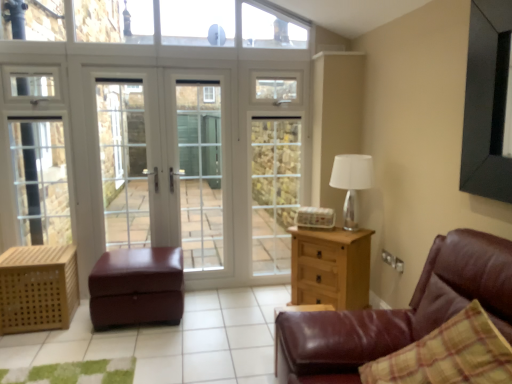
Identify the location of brown leather couch at right. This screenshot has width=512, height=384. (401, 312).

The image size is (512, 384). What do you see at coordinates (401, 312) in the screenshot? I see `brown leather couch at right` at bounding box center [401, 312].

Identify the location of white glass screen door at center, acting as the second screen door starting from the left. (200, 172).

The height and width of the screenshot is (384, 512). In order to click on white glass screen door at center, which ranks as the first screen door in right-to-left order in this screenshot , I will do `click(274, 190)`.

What do you see at coordinates (274, 190) in the screenshot?
I see `white glass screen door at center, which ranks as the first screen door in right-to-left order` at bounding box center [274, 190].

You are a GUI agent. You are given a task and a screenshot of the screen. Output one action in this format:
    pyautogui.click(x=<x>, y=<y>)
    Task: Click on the white glass screen door at left, the third screen door when ordered from right to left
    
    Given the screenshot: What is the action you would take?
    pyautogui.click(x=123, y=162)

From the image's perspective, is clear glass window at upper center above white glass door at center?

Correct, clear glass window at upper center appears higher than white glass door at center in the image.

Would you say clear glass window at upper center is inside or outside white glass door at center?

clear glass window at upper center is outside white glass door at center.

Are clear glass window at upper center and white glass door at center making contact?

No, clear glass window at upper center is not next to white glass door at center.

From the image's perspective, is clear glass window at upper center positioned above or below light wood/texture chest of drawers at right?

From the image's perspective, clear glass window at upper center appears above light wood/texture chest of drawers at right.

Can you confirm if clear glass window at upper center is positioned to the right of light wood/texture chest of drawers at right?

No.

Is clear glass window at upper center further to camera compared to light wood/texture chest of drawers at right?

Yes, clear glass window at upper center is further from the camera.

Is clear glass window at upper center oriented towards light wood/texture chest of drawers at right?

No, clear glass window at upper center is not oriented towards light wood/texture chest of drawers at right.

Are light wood/texture chest of drawers at right and silver metallic table lamp at upper right located far from each other?

They are positioned close to each other.

Considering the positions of objects light wood/texture chest of drawers at right and silver metallic table lamp at upper right in the image provided, who is in front, light wood/texture chest of drawers at right or silver metallic table lamp at upper right?

light wood/texture chest of drawers at right is closer to the camera.

Considering the relative sizes of light wood/texture chest of drawers at right and silver metallic table lamp at upper right in the image provided, is light wood/texture chest of drawers at right wider than silver metallic table lamp at upper right?

Yes.

From a real-world perspective, is light wood/texture chest of drawers at right below silver metallic table lamp at upper right?

Correct, in the physical world, light wood/texture chest of drawers at right is lower than silver metallic table lamp at upper right.

Which of these two, brown leather couch at right or white glass screen door at center, the 2th screen door viewed from the right, stands shorter?

With less height is brown leather couch at right.

From the image's perspective, is brown leather couch at right positioned above or below white glass screen door at center, the 2th screen door viewed from the right?

brown leather couch at right is situated lower than white glass screen door at center, the 2th screen door viewed from the right, in the image.

From the picture: Considering the relative positions of brown leather couch at right and white glass screen door at center, the 2th screen door viewed from the right, in the image provided, is brown leather couch at right to the left of white glass screen door at center, the 2th screen door viewed from the right, from the viewer's perspective?

No, brown leather couch at right is not to the left of white glass screen door at center, the 2th screen door viewed from the right.

Find the location of a particular element. Image resolution: width=512 pixels, height=384 pixels. studio couch on the right side of white glass screen door at center, the 2th screen door viewed from the right is located at coordinates (401, 312).

Between light wood/texture chest of drawers at right and clear glass window at upper center, which one appears on the left side from the viewer's perspective?

Positioned to the left is clear glass window at upper center.

Considering the points (317, 290) and (207, 25), which point is behind, point (317, 290) or point (207, 25)?

The point (207, 25) is farther from the camera.

Which is in front, light wood/texture chest of drawers at right or clear glass window at upper center?

Positioned in front is light wood/texture chest of drawers at right.

Considering the sizes of light wood/texture chest of drawers at right and clear glass window at upper center in the image, is light wood/texture chest of drawers at right bigger or smaller than clear glass window at upper center?

light wood/texture chest of drawers at right is bigger than clear glass window at upper center.

Considering the positions of points (63, 298) and (140, 183), is point (63, 298) closer to camera compared to point (140, 183)?

Yes, point (63, 298) is in front of point (140, 183).

The height and width of the screenshot is (384, 512). I want to click on nightstand in front of the white glass screen door at left, the third screen door when ordered from right to left, so click(38, 288).

Looking at this image, measure the distance between wooden crate at lower left and white glass screen door at left, the third screen door when ordered from right to left.

wooden crate at lower left is 30.15 inches from white glass screen door at left, the third screen door when ordered from right to left.

Is wooden crate at lower left placed right next to white glass screen door at left, the third screen door when ordered from right to left?

No, wooden crate at lower left is not in contact with white glass screen door at left, the third screen door when ordered from right to left.

Considering the relative sizes of leather ottoman at center and white glass screen door at center, the 2th screen door viewed from the right, in the image provided, is leather ottoman at center taller than white glass screen door at center, the 2th screen door viewed from the right,?

No.

Locate an element on the screen. The height and width of the screenshot is (384, 512). screen door that is the 1st object above the leather ottoman at center (from a real-world perspective) is located at coordinates (200, 172).

Looking at the image, does leather ottoman at center seem bigger or smaller compared to white glass screen door at center, the 2th screen door viewed from the right?

Clearly, leather ottoman at center is larger in size than white glass screen door at center, the 2th screen door viewed from the right.

Does leather ottoman at center have a greater width compared to white glass screen door at center, the 2th screen door viewed from the right?

Yes.

The width and height of the screenshot is (512, 384). Identify the location of door on the left of clear glass window at upper center. (163, 163).

This screenshot has height=384, width=512. Identify the location of window above the light wood/texture chest of drawers at right (from a real-world perspective). (228, 25).

From the image, which object appears to be farther from white glass door at center, leather ottoman at center or silver metallic table lamp at upper right?

silver metallic table lamp at upper right is further to white glass door at center.

Looking at the image, which one is located further to white glass door at center, white glass screen door at left, which ranks as the 1th screen door in left-to-right order, or light wood/texture chest of drawers at right?

The object further to white glass door at center is light wood/texture chest of drawers at right.

Which object lies nearer to the anchor point white glass screen door at center, which ranks as the third screen door in left-to-right order, silver metallic table lamp at upper right or wooden crate at lower left?

silver metallic table lamp at upper right is closer to white glass screen door at center, which ranks as the third screen door in left-to-right order.

Estimate the real-world distances between objects in this image. Which object is further from white glass door at center, white glass screen door at center, which ranks as the third screen door in left-to-right order, or white glass screen door at center, the 2th screen door viewed from the right?

white glass screen door at center, which ranks as the third screen door in left-to-right order, lies further to white glass door at center than the other object.

Which object lies further to the anchor point light wood/texture chest of drawers at right, white glass screen door at center, acting as the second screen door starting from the left, or brown leather couch at right?

white glass screen door at center, acting as the second screen door starting from the left, is positioned further to the anchor light wood/texture chest of drawers at right.

From the image, which object appears to be farther from clear glass window at upper center, wooden crate at lower left or white glass screen door at center, acting as the second screen door starting from the left?

Among the two, wooden crate at lower left is located further to clear glass window at upper center.

Looking at the image, which one is located closer to white glass screen door at center, which ranks as the third screen door in left-to-right order, white glass screen door at left, the third screen door when ordered from right to left, or wooden crate at lower left?

Among the two, white glass screen door at left, the third screen door when ordered from right to left, is located nearer to white glass screen door at center, which ranks as the third screen door in left-to-right order.

Considering their positions, is silver metallic table lamp at upper right positioned further to white glass screen door at left, the third screen door when ordered from right to left, than white glass door at center?

silver metallic table lamp at upper right.

Where is `chest of drawers between brown leather couch at right and leather ottoman at center along the z-axis`? The width and height of the screenshot is (512, 384). chest of drawers between brown leather couch at right and leather ottoman at center along the z-axis is located at coordinates (330, 267).

Where is `door located between leather ottoman at center and silver metallic table lamp at upper right in the left-right direction`? The image size is (512, 384). door located between leather ottoman at center and silver metallic table lamp at upper right in the left-right direction is located at coordinates (163, 163).

Image resolution: width=512 pixels, height=384 pixels. I want to click on chest of drawers between brown leather couch at right and white glass screen door at center, acting as the second screen door starting from the left, in the front-back direction, so click(330, 267).

You are a GUI agent. You are given a task and a screenshot of the screen. Output one action in this format:
    pyautogui.click(x=<x>, y=<y>)
    Task: Click on the chest of drawers between wooden crate at lower left and silver metallic table lamp at upper right
    
    Given the screenshot: What is the action you would take?
    pyautogui.click(x=330, y=267)